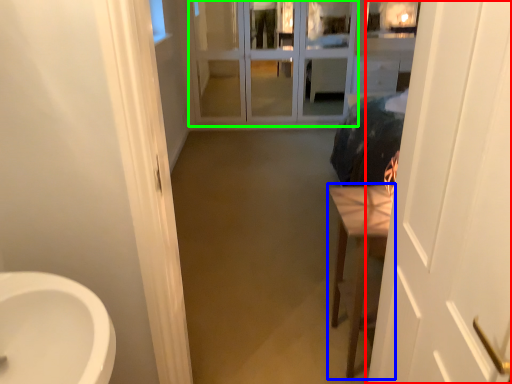
Question: Which object is the closest to the door (highlighted by a red box)? Choose among these: furniture (highlighted by a blue box) or screen door (highlighted by a green box).

Choices:
 (A) furniture
 (B) screen door

Answer: (A)